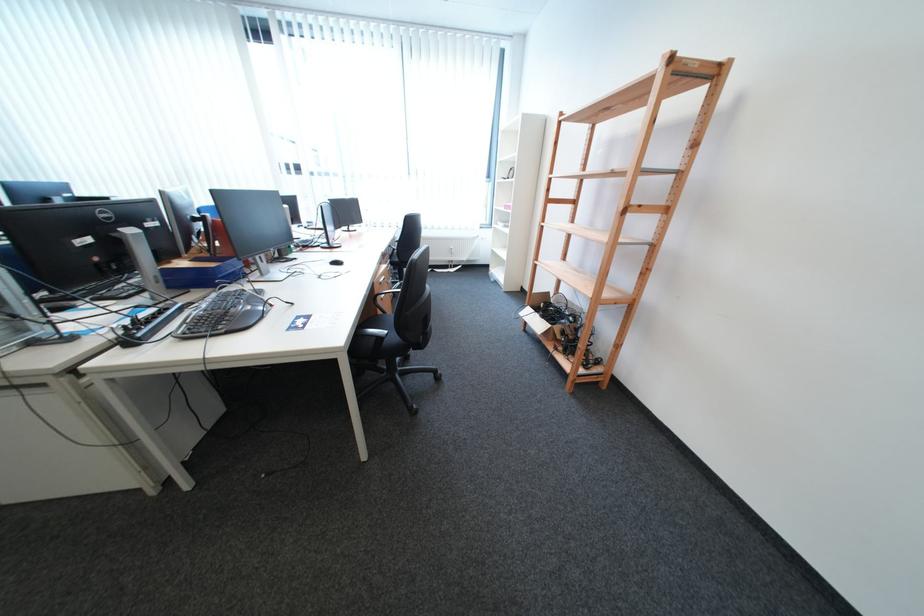
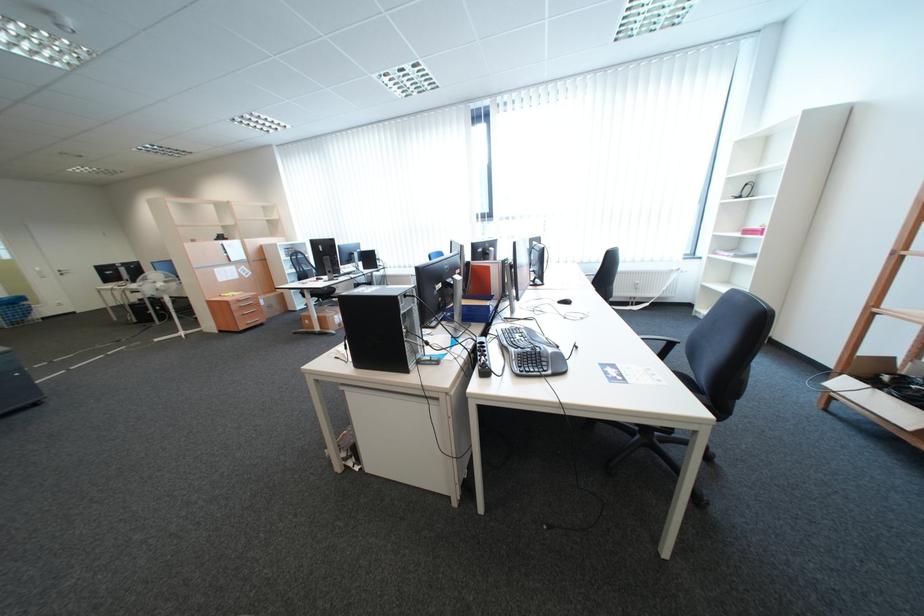
Question: The camera is either moving clockwise (left) or counter-clockwise (right) around the object. The first image is from the beginning of the video and the second image is from the end. Is the camera moving left or right when shooting the video?

Choices:
 (A) Left
 (B) Right

Answer: (B)